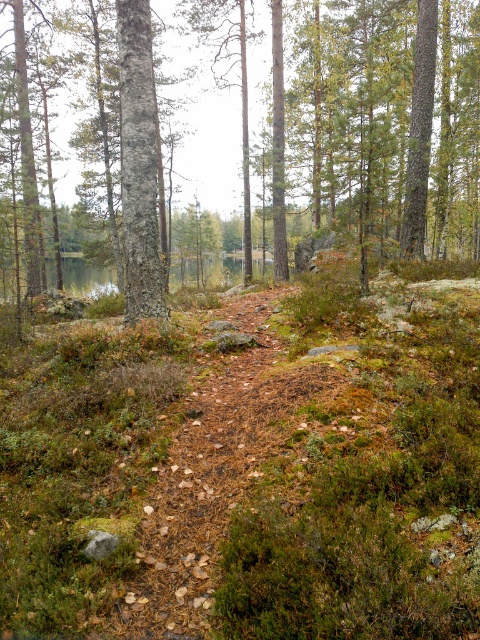
You are standing at the point labeled as point (375,131) in the forest. What type of tree are you touching?

The point (375,131) is on a brown bark tree at center, so you are touching a brown bark tree at center.